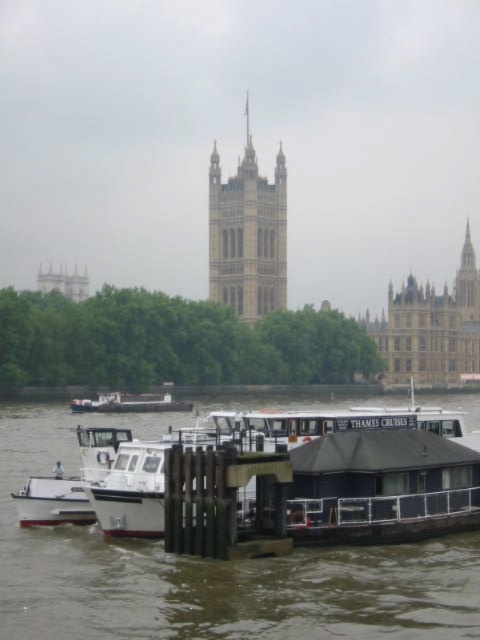
Is the position of brown stone building at center less distant than that of white matte boat at center?

No, it is behind white matte boat at center.

Which is above, brown stone building at center or white matte boat at center?

brown stone building at center is above.

Which is behind, point (432, 333) or point (163, 397)?

Point (432, 333)

Find the location of a particular element. Image resolution: width=480 pixels, height=640 pixels. brown stone building at center is located at coordinates (431, 328).

Who is higher up, stone tower at center or brown stone building at center?

stone tower at center

What do you see at coordinates (248, 234) in the screenshot? This screenshot has width=480, height=640. I see `stone tower at center` at bounding box center [248, 234].

Identify the location of stone tower at center. (248, 234).

Does brown wooden dock at lower center appear on the right side of stone tower at center?

In fact, brown wooden dock at lower center is to the left of stone tower at center.

Between brown wooden dock at lower center and stone tower at center, which one is positioned lower?

Positioned lower is brown wooden dock at lower center.

Does point (269, 577) come in front of point (225, 202)?

Yes, point (269, 577) is closer to viewer.

Identify the location of brown wooden dock at lower center. Image resolution: width=480 pixels, height=640 pixels. (208, 570).